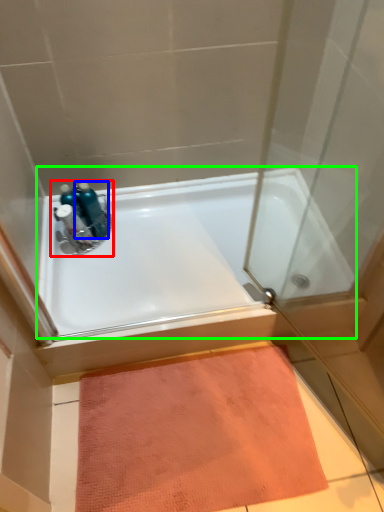
Question: Considering the real-world distances, which object is closest to sink (highlighted by a red box)? bottle (highlighted by a blue box) or bathtub (highlighted by a green box).

Choices:
 (A) bottle
 (B) bathtub

Answer: (A)